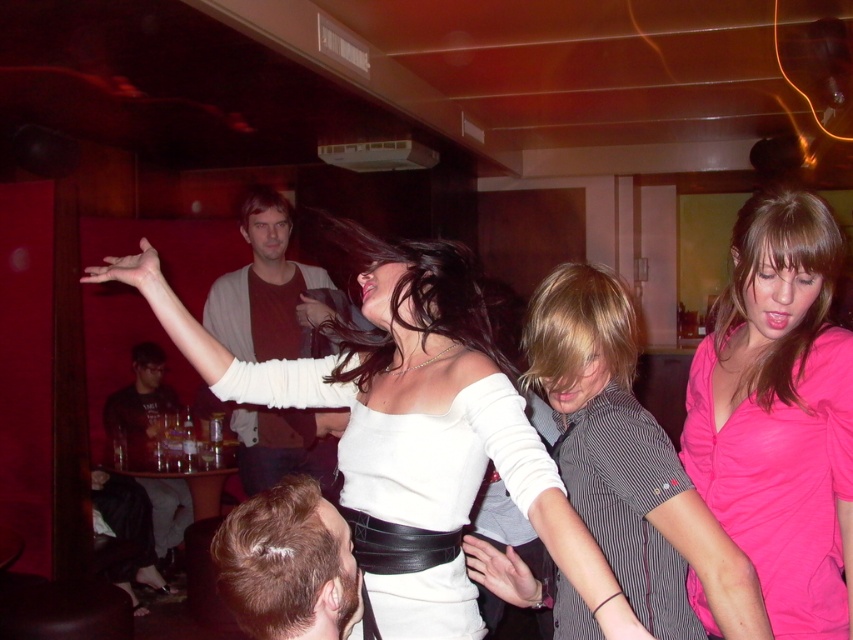
You are standing in the center of the room and want to locate the pink satin blouse at lower right. Based on the coordinates provided, in which direction should you look to find it?

The pink satin blouse at lower right is located at coordinates point [780,413], so you should look to the lower right direction to find it.

You are organizing a charity event and need to arrange seating based on the guests clothing. The pink satin blouse at lower right and the matte brown shirt at center are two guests. Which guest should be seated closer to the stage so they can be seen better?

The pink satin blouse at lower right should be seated closer to the stage because it is shorter than the matte brown shirt at center, ensuring visibility.

You are a photographer at the party and want to capture a photo that includes both the pink satin blouse at lower right and the dark gray shirt at lower left. The camera you are using has a maximum focus range of 3 meters. Can you fit both subjects in the frame without moving closer?

The distance between the pink satin blouse at lower right and the dark gray shirt at lower left is 3.60 meters, which exceeds the camera maximum focus range of 3 meters. Therefore, you cannot capture both subjects in the frame without moving closer.